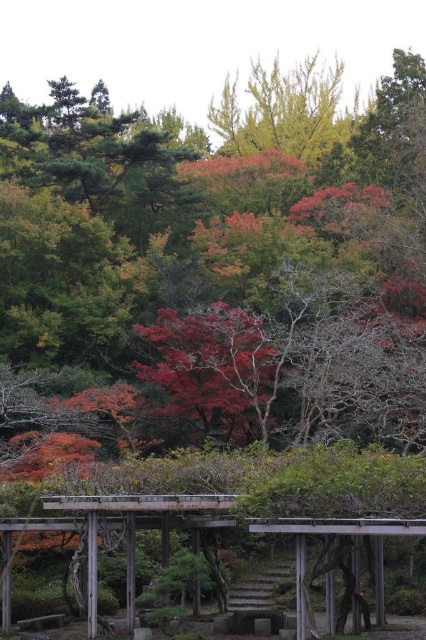
Can you confirm if shiny red maple at center is positioned to the left of yellow-green leafy tree at upper center?

Indeed, shiny red maple at center is positioned on the left side of yellow-green leafy tree at upper center.

Does shiny red maple at center have a lesser height compared to yellow-green leafy tree at upper center?

Indeed, shiny red maple at center has a lesser height compared to yellow-green leafy tree at upper center.

What are the coordinates of `shiny red maple at center` in the screenshot? It's located at (213, 368).